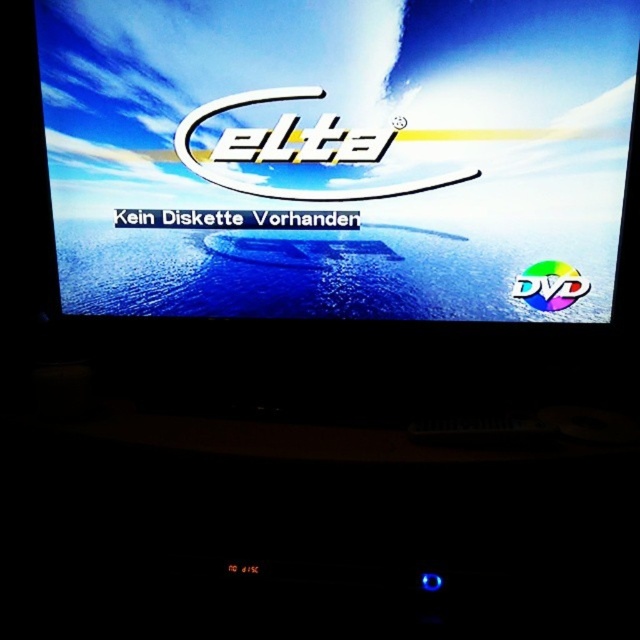
Question: Does matte plastic screen at center appear over rainbow plastic dvd at right?

Choices:
 (A) no
 (B) yes

Answer: (B)

Question: Which of the following is the closest to the observer?

Choices:
 (A) (225, 189)
 (B) (528, 296)

Answer: (B)

Question: Does matte plastic screen at center have a greater width compared to rainbow plastic dvd at right?

Choices:
 (A) yes
 (B) no

Answer: (A)

Question: Which point is closer to the camera?

Choices:
 (A) matte plastic screen at center
 (B) rainbow plastic dvd at right

Answer: (A)

Question: Is matte plastic screen at center closer to the viewer compared to rainbow plastic dvd at right?

Choices:
 (A) yes
 (B) no

Answer: (A)

Question: Which point is closer to the camera?

Choices:
 (A) rainbow plastic dvd at right
 (B) matte plastic screen at center

Answer: (B)